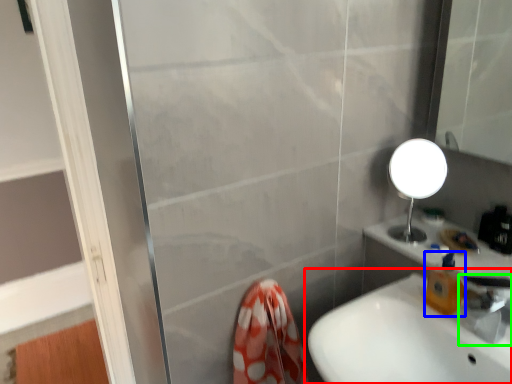
Question: Which object is positioned closest to sink (highlighted by a red box)? Select from soap dispenser (highlighted by a blue box) and tap (highlighted by a green box).

Choices:
 (A) soap dispenser
 (B) tap

Answer: (A)